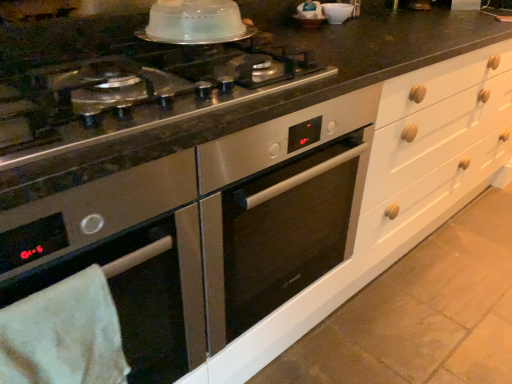
Question: Is white towel at lower left directly adjacent to stainless steel cooktop at center?

Choices:
 (A) no
 (B) yes

Answer: (A)

Question: Is white towel at lower left shorter than stainless steel cooktop at center?

Choices:
 (A) yes
 (B) no

Answer: (B)

Question: From the image's perspective, does white towel at lower left appear higher than stainless steel cooktop at center?

Choices:
 (A) no
 (B) yes

Answer: (A)

Question: Are white towel at lower left and stainless steel cooktop at center located far from each other?

Choices:
 (A) yes
 (B) no

Answer: (B)

Question: From a real-world perspective, is white towel at lower left positioned under stainless steel cooktop at center based on gravity?

Choices:
 (A) yes
 (B) no

Answer: (A)

Question: Does white towel at lower left have a greater width compared to stainless steel cooktop at center?

Choices:
 (A) no
 (B) yes

Answer: (A)

Question: Is stainless steel cooktop at center taller than white glossy bowl at upper center?

Choices:
 (A) no
 (B) yes

Answer: (A)

Question: Is stainless steel cooktop at center outside white glossy bowl at upper center?

Choices:
 (A) no
 (B) yes

Answer: (B)

Question: Does stainless steel cooktop at center have a lesser width compared to white glossy bowl at upper center?

Choices:
 (A) no
 (B) yes

Answer: (A)

Question: Is stainless steel cooktop at center looking in the opposite direction of white glossy bowl at upper center?

Choices:
 (A) no
 (B) yes

Answer: (A)

Question: Is the position of stainless steel cooktop at center less distant than that of white glossy bowl at upper center?

Choices:
 (A) no
 (B) yes

Answer: (B)

Question: From a real-world perspective, does stainless steel cooktop at center stand above white glossy bowl at upper center?

Choices:
 (A) no
 (B) yes

Answer: (A)

Question: Is white glossy bowl at upper center inside clear plastic dome at upper center?

Choices:
 (A) yes
 (B) no

Answer: (B)